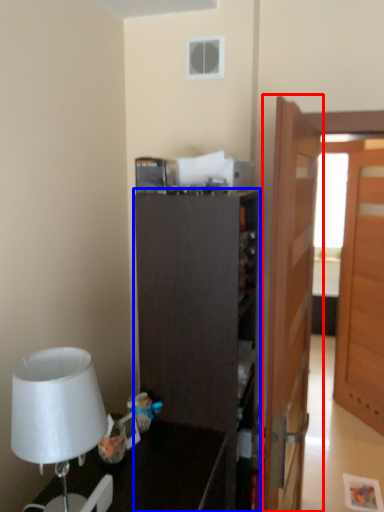
Question: Which object is further to the camera taking this photo, door (highlighted by a red box) or cabinetry (highlighted by a blue box)?

Choices:
 (A) door
 (B) cabinetry

Answer: (B)